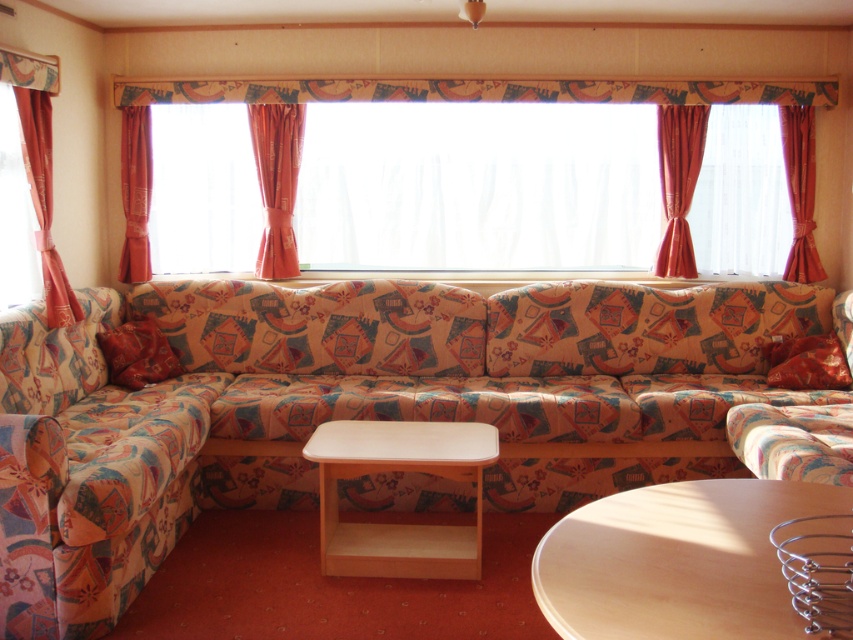
Question: Is orange fabric curtain at left bigger than velvet red pillow at lower left?

Choices:
 (A) no
 (B) yes

Answer: (A)

Question: Is light brown wooden round table at center wider than coral fabric curtain at center?

Choices:
 (A) yes
 (B) no

Answer: (A)

Question: Which object is the closest to the velvet orange curtain at right?

Choices:
 (A) orange fabric curtain at left
 (B) light brown wooden round table at center
 (C) coral fabric curtain at left
 (D) light brown wooden table at center

Answer: (B)

Question: Which point is closer to the camera?

Choices:
 (A) (125, 259)
 (B) (265, 180)
 (C) (483, 465)
 (D) (364, 90)

Answer: (C)

Question: Which object appears closest to the camera in this image?

Choices:
 (A) velvet red curtain at right
 (B) light brown wooden table at center

Answer: (B)

Question: Considering the relative positions of light brown wooden table at center and transparent glass window at left in the image provided, where is light brown wooden table at center located with respect to transparent glass window at left?

Choices:
 (A) left
 (B) right

Answer: (B)